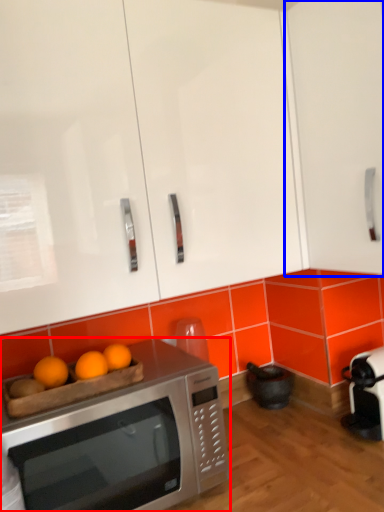
Question: Which object is further to the camera taking this photo, microwave oven (highlighted by a red box) or cabinetry (highlighted by a blue box)?

Choices:
 (A) microwave oven
 (B) cabinetry

Answer: (B)